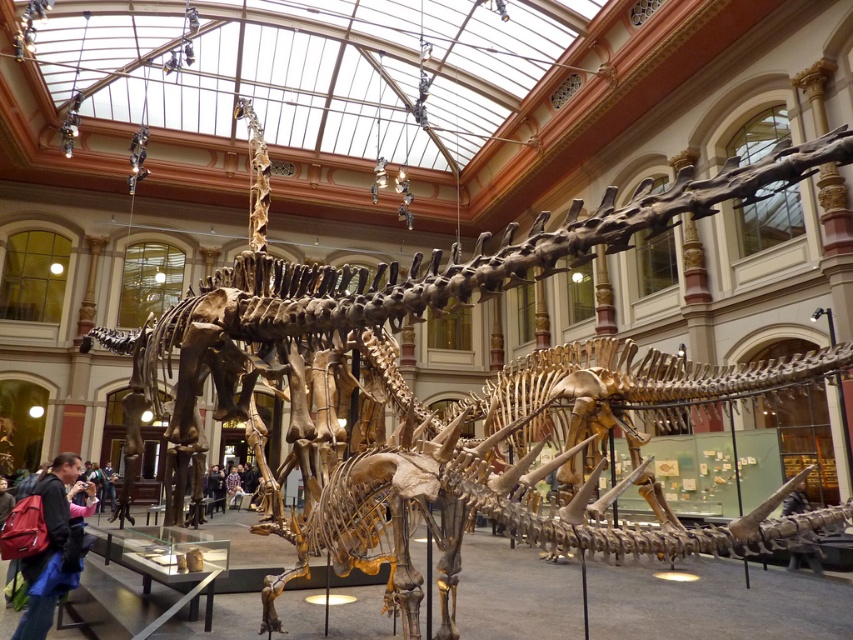
Question: Which point is closer to the camera taking this photo?

Choices:
 (A) (242, 493)
 (B) (18, 536)
 (C) (213, 483)

Answer: (B)

Question: Does red backpack at lower left have a smaller size compared to smooth wooden stick at lower right?

Choices:
 (A) yes
 (B) no

Answer: (B)

Question: Which point is farther from the camera taking this photo?

Choices:
 (A) (817, 556)
 (B) (207, 506)
 (C) (241, 483)
 (D) (51, 509)

Answer: (C)

Question: Is red backpack at lower left positioned in front of dark blue jacket at center?

Choices:
 (A) no
 (B) yes

Answer: (B)

Question: Is red backpack at lower left to the right of dark blue jacket at center from the viewer's perspective?

Choices:
 (A) no
 (B) yes

Answer: (B)

Question: Which object is the closest to the plaid shirt at center?

Choices:
 (A) smooth wooden stick at lower right
 (B) red backpack at lower left

Answer: (B)